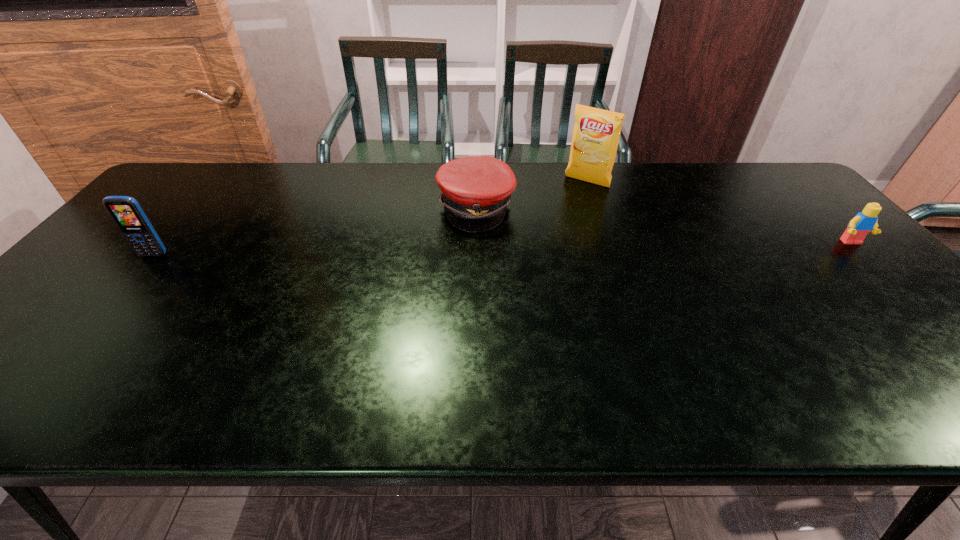
Find the location of a particular element. The image size is (960, 540). vacant point located on the front-facing side of the cap is located at coordinates (555, 249).

Where is `free location located 0.320m on the front-facing side of the cap`? The width and height of the screenshot is (960, 540). free location located 0.320m on the front-facing side of the cap is located at coordinates (603, 274).

The height and width of the screenshot is (540, 960). I want to click on vacant region located on the front of the tallest object with the logo, so click(x=554, y=221).

You are a GUI agent. You are given a task and a screenshot of the screen. Output one action in this format:
    pyautogui.click(x=<x>, y=<y>)
    Task: Click on the free region located on the front of the tallest object with the logo
    The image size is (960, 540).
    Given the screenshot: What is the action you would take?
    pyautogui.click(x=572, y=197)

At what (x,y) coordinates should I click in order to perform the action: click on free location located on the front of the tallest object with the logo. Please return your answer as a coordinate pair (x, y). Looking at the image, I should click on (528, 255).

The width and height of the screenshot is (960, 540). In order to click on cap at the far edge in this screenshot , I will do `click(476, 190)`.

This screenshot has width=960, height=540. What are the coordinates of `crisp (potato chip) situated at the far edge` in the screenshot? It's located at (596, 133).

Where is `object located in the left edge section of the desktop`? This screenshot has width=960, height=540. object located in the left edge section of the desktop is located at coordinates click(x=127, y=213).

The width and height of the screenshot is (960, 540). What are the coordinates of `object that is positioned at the right edge` in the screenshot? It's located at (865, 221).

The width and height of the screenshot is (960, 540). In order to click on vacant space at the far edge of the desktop in this screenshot , I will do `click(348, 168)`.